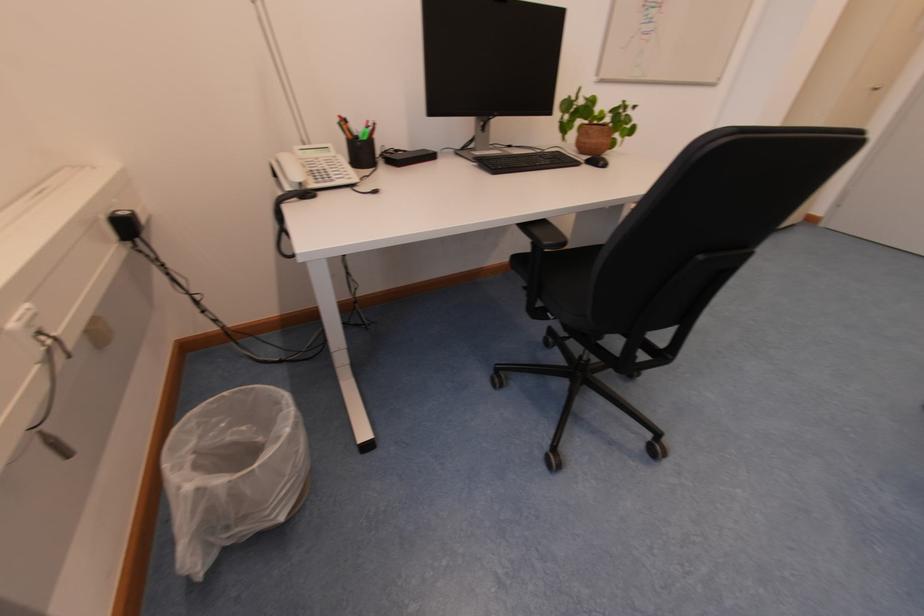
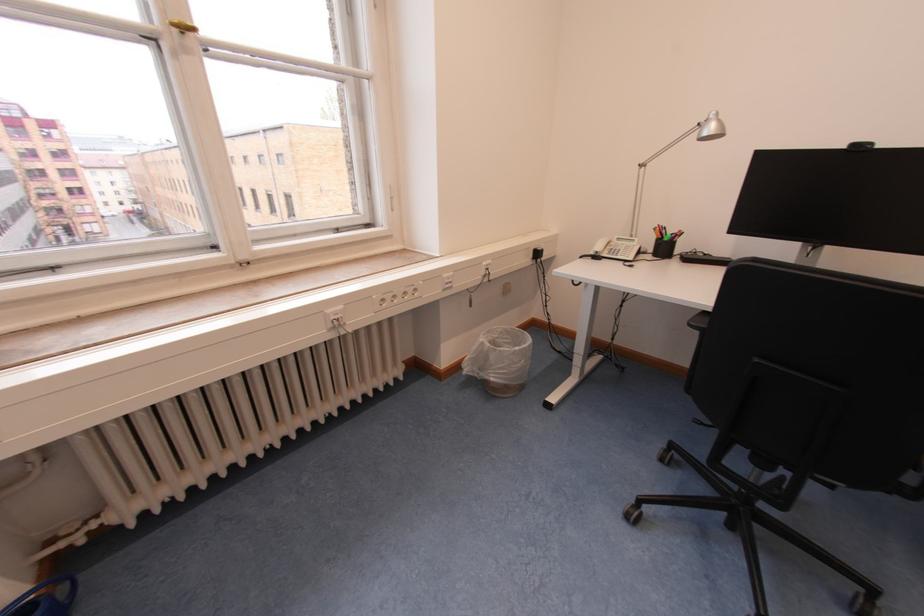
Where in the second image is the point corresponding to pixel 111 220 from the first image?

(540, 251)